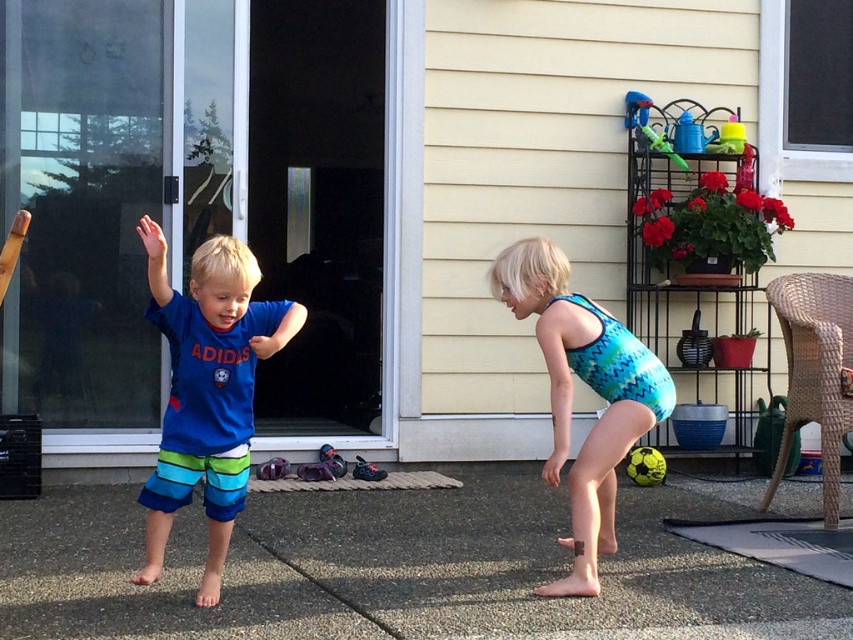
You are a delivery person who needs to deliver a package to the house. The address says the house number is 123. You see the transparent glass screen door at center. Where should you go to find the house number 123?

The house number 123 is likely located on the transparent glass screen door at center at point 0.374 on the door.

You are a photographer trying to capture a group photo of the teal zigzag swimsuit at center and the yellow rubber ball at center. Your camera has a minimum focus distance of 2 meters. Can you take a clear photo of both subjects without moving them?

The teal zigzag swimsuit at center is 1.99 meters away from the yellow rubber ball at center. Since the distance between them is less than the camera minimum focus distance of 2 meters, the photographer cannot take a clear photo of both subjects without moving them.